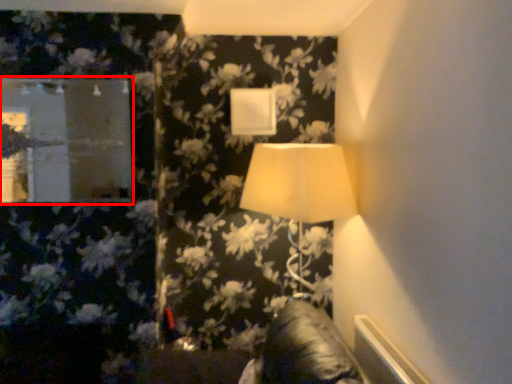
Question: Considering the relative positions of mirror (annotated by the red box) and lamp in the image provided, where is mirror (annotated by the red box) located with respect to the staircase?

Choices:
 (A) right
 (B) left

Answer: (B)